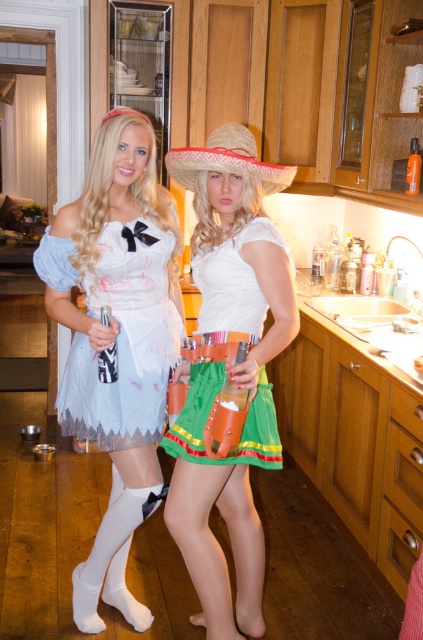
Is green fabric skirt at center smaller than straw hat at center?

Incorrect, green fabric skirt at center is not smaller in size than straw hat at center.

Who is more distant from viewer, (286, 340) or (211, 157)?

The point (286, 340) is behind.

You are a GUI agent. You are given a task and a screenshot of the screen. Output one action in this format:
    pyautogui.click(x=<x>, y=<y>)
    Task: Click on the green fabric skirt at center
    The width and height of the screenshot is (423, 640).
    Given the screenshot: What is the action you would take?
    pyautogui.click(x=230, y=371)

Which of these two, white tulle dress at left or straw hat at center, stands taller?

white tulle dress at left is taller.

What do you see at coordinates (117, 340) in the screenshot?
I see `white tulle dress at left` at bounding box center [117, 340].

Which is behind, point (137, 388) or point (170, 173)?

Positioned behind is point (170, 173).

Where is `white tulle dress at left`? Image resolution: width=423 pixels, height=640 pixels. white tulle dress at left is located at coordinates coord(117,340).

Looking at this image, is white tulle dress at left thinner than green fabric skirt at center?

No, white tulle dress at left is not thinner than green fabric skirt at center.

Does point (74, 262) come closer to viewer compared to point (238, 512)?

Yes, point (74, 262) is closer to viewer.

You are a GUI agent. You are given a task and a screenshot of the screen. Output one action in this format:
    pyautogui.click(x=<x>, y=<y>)
    Task: Click on the white tulle dress at left
    
    Given the screenshot: What is the action you would take?
    pyautogui.click(x=117, y=340)